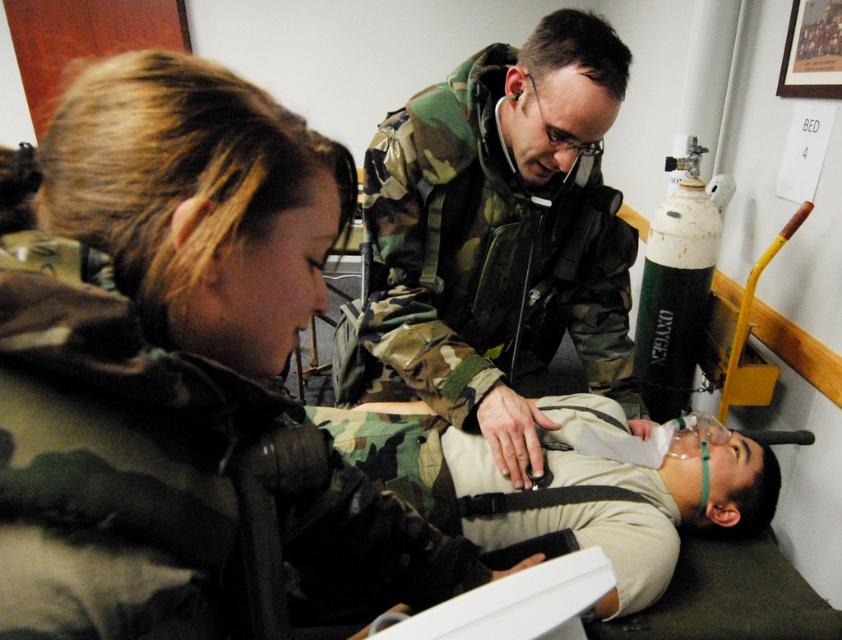
Is camouflage jacket at upper left to the right of camouflage uniform at center from the viewer's perspective?

Incorrect, camouflage jacket at upper left is not on the right side of camouflage uniform at center.

Describe the element at coordinates (169, 244) in the screenshot. I see `camouflage jacket at upper left` at that location.

Does point (104, 176) come farther from viewer compared to point (565, 173)?

No.

Image resolution: width=842 pixels, height=640 pixels. What are the coordinates of `camouflage jacket at upper left` in the screenshot? It's located at (169, 244).

Measure the distance from camouflage jacket at upper left to white plastic tray at center.

10.25 inches

Which is behind, point (267, 376) or point (589, 561)?

The point (267, 376) is more distant.

I want to click on camouflage jacket at upper left, so click(169, 244).

Is camouflage uniform at center positioned behind white plastic tray at center?

That is True.

Find the location of a particular element. The height and width of the screenshot is (640, 842). camouflage uniform at center is located at coordinates (499, 236).